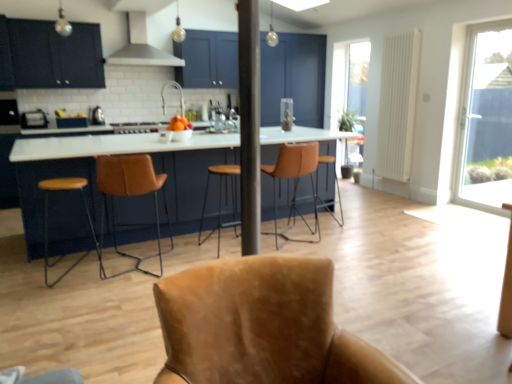
The image size is (512, 384). What do you see at coordinates (249, 124) in the screenshot?
I see `metallic pole at center` at bounding box center [249, 124].

The height and width of the screenshot is (384, 512). Describe the element at coordinates (34, 119) in the screenshot. I see `matte black toaster at left, positioned as the second appliance in back-to-front order` at that location.

The width and height of the screenshot is (512, 384). What are the coordinates of `matte black toaster at left, positioned as the second appliance in back-to-front order` in the screenshot? It's located at coord(34,119).

Looking at this image, in order to face transparent glass door at right, should I rotate leftwards or rightwards?

Rotate your view right by about 29.318°.

What is the approximate width of white glossy table at center?

1.30 meters.

Image resolution: width=512 pixels, height=384 pixels. What do you see at coordinates (327, 185) in the screenshot? I see `brown leather bar stool at center, marked as the second bar stool in a left-to-right arrangement` at bounding box center [327, 185].

Locate an element on the screen. This screenshot has height=384, width=512. satin silver toaster at left, which ranks as the 3th appliance in front-to-back order is located at coordinates (97, 116).

Consider the image. How far apart are brown leather bar stool at center, which appears as the 1th bar stool when viewed from the left, and white glossy table at center?

A distance of 21.81 inches exists between brown leather bar stool at center, which appears as the 1th bar stool when viewed from the left, and white glossy table at center.

Can you confirm if brown leather bar stool at center, which appears as the 1th bar stool when viewed from the left, is thinner than white glossy table at center?

Yes, brown leather bar stool at center, which appears as the 1th bar stool when viewed from the left, is thinner than white glossy table at center.

From a real-world perspective, is brown leather bar stool at center, marked as the 2th bar stool in a right-to-left arrangement, on white glossy table at center?

Incorrect, from a real-world perspective, brown leather bar stool at center, marked as the 2th bar stool in a right-to-left arrangement, is lower than white glossy table at center.

Is brown leather bar stool at center, acting as the 1th bar stool starting from the front, inside or outside of white glossy table at center?

brown leather bar stool at center, acting as the 1th bar stool starting from the front, fits inside white glossy table at center.

Is matte black toaster at left, the 2th appliance in the right-to-left sequence, not inside suede tan armchair at center, marked as the 4th chair in a back-to-front arrangement?

That's correct, matte black toaster at left, the 2th appliance in the right-to-left sequence, is outside of suede tan armchair at center, marked as the 4th chair in a back-to-front arrangement.

Is matte black toaster at left, the 2th appliance in the right-to-left sequence, taller or shorter than suede tan armchair at center, marked as the 4th chair in a back-to-front arrangement?

In the image, matte black toaster at left, the 2th appliance in the right-to-left sequence, appears to be shorter than suede tan armchair at center, marked as the 4th chair in a back-to-front arrangement.

From a real-world perspective, between matte black toaster at left, positioned as the second appliance in back-to-front order, and suede tan armchair at center, marked as the 4th chair in a back-to-front arrangement, who is vertically lower?

suede tan armchair at center, marked as the 4th chair in a back-to-front arrangement, is physically lower.

Does point (6, 84) come farther from viewer compared to point (154, 129)?

No, it is not.

Are matte black cabinets at upper left and white glossy stove at center far apart?

No.

Considering the sizes of objects matte black cabinets at upper left and white glossy stove at center in the image provided, who is shorter, matte black cabinets at upper left or white glossy stove at center?

white glossy stove at center is shorter.

How many degrees apart are the facing directions of matte black cabinets at upper left and white glossy stove at center?

The facing directions of matte black cabinets at upper left and white glossy stove at center are 0.672 degrees apart.

Can you confirm if brown leather stool at left, placed as the second chair when sorted from back to front, is smaller than metallic pole at center?

No.

Considering the positions of point (46, 275) and point (241, 226), is point (46, 275) closer or farther from the camera than point (241, 226)?

Point (46, 275).

Is brown leather stool at left, placed as the second chair when sorted from back to front, positioned with its back to metallic pole at center?

No.

From a real-world perspective, count 4th chairs downward from the metallic pole at center and point to it. Please provide its 2D coordinates.

[(48, 217)]

Is point (98, 247) positioned after point (155, 65)?

No, (98, 247) is in front of (155, 65).

From a real-world perspective, is brown leather stool at left, placed as the second chair when sorted from back to front, beneath satin silver metal at upper center?

Yes, from a real-world perspective, brown leather stool at left, placed as the second chair when sorted from back to front, is under satin silver metal at upper center.

From the image's perspective, is brown leather stool at left, which is counted as the 3th chair, starting from the front, above satin silver metal at upper center?

No, from the image's perspective, brown leather stool at left, which is counted as the 3th chair, starting from the front, is not on top of satin silver metal at upper center.

Does brown leather stool at left, placed as the second chair when sorted from back to front, come behind satin silver metal at upper center?

No, brown leather stool at left, placed as the second chair when sorted from back to front, is in front of satin silver metal at upper center.

From the picture: Is brown leather stool at left, placed as the second chair when sorted from back to front, thinner than transparent glass screen door at center?

Indeed, brown leather stool at left, placed as the second chair when sorted from back to front, has a lesser width compared to transparent glass screen door at center.

Considering the sizes of objects brown leather stool at left, which is counted as the 3th chair, starting from the front, and transparent glass screen door at center in the image provided, who is taller, brown leather stool at left, which is counted as the 3th chair, starting from the front, or transparent glass screen door at center?

transparent glass screen door at center is taller.

Considering the sizes of brown leather bar stool at center, marked as the second bar stool in a left-to-right arrangement, and suede tan armchair at center, the 1th chair positioned from the front, in the image, is brown leather bar stool at center, marked as the second bar stool in a left-to-right arrangement, bigger or smaller than suede tan armchair at center, the 1th chair positioned from the front,?

brown leather bar stool at center, marked as the second bar stool in a left-to-right arrangement, is smaller than suede tan armchair at center, the 1th chair positioned from the front.

Is point (331, 201) closer or farther from the camera than point (256, 364)?

Point (331, 201) is farther from the camera than point (256, 364).

From a real-world perspective, count 2nd bar stools downward from the suede tan armchair at center, the 1th chair positioned from the front, and point to it. Please provide its 2D coordinates.

[(327, 185)]

Looking at this image, between brown leather bar stool at center, the first bar stool viewed from the back, and suede tan armchair at center, marked as the 4th chair in a back-to-front arrangement, which one appears on the right side from the viewer's perspective?

Positioned to the right is brown leather bar stool at center, the first bar stool viewed from the back.

Locate an element on the screen. the 1st bar stool positioned below the white glossy table at center (from a real-world perspective) is located at coordinates (221, 200).

Where is `appliance that is the 2nd one when counting leftward from the suede tan armchair at center, the 1th chair positioned from the front`? This screenshot has height=384, width=512. appliance that is the 2nd one when counting leftward from the suede tan armchair at center, the 1th chair positioned from the front is located at coordinates (34, 119).

Looking at the image, which one is located closer to satin silver toaster at left, which appears as the 3th appliance when viewed from the left, satin silver metal at upper center or brown leather bar stool at center, the first bar stool viewed from the back?

satin silver metal at upper center is positioned closer to the anchor satin silver toaster at left, which appears as the 3th appliance when viewed from the left.

Estimate the real-world distances between objects in this image. Which object is further from brown leather bar stool at center, acting as the 1th bar stool starting from the front, matte black toaster at left, positioned as the second appliance in back-to-front order, or transparent glass door at right?

The object further to brown leather bar stool at center, acting as the 1th bar stool starting from the front, is transparent glass door at right.

From the image, which object appears to be farther from leather at left, placed as the 3th chair when sorted from back to front, white glossy table at center or leather bar stool at center, which is the 4th chair from front to back?

leather bar stool at center, which is the 4th chair from front to back.

Estimate the real-world distances between objects in this image. Which object is further from brown leather stool at left, which is counted as the 3th chair, starting from the front, white glossy stove at center or matte black cabinets at upper left?

matte black cabinets at upper left lies further to brown leather stool at left, which is counted as the 3th chair, starting from the front, than the other object.

Which object lies nearer to the anchor point satin silver toaster at left, which ranks as the 3th appliance in front-to-back order, white glossy table at center or brown leather bar stool at center, arranged as the second bar stool when viewed from the front?

white glossy table at center lies closer to satin silver toaster at left, which ranks as the 3th appliance in front-to-back order, than the other object.

When comparing their distances from transparent glass screen door at center, does matte black cabinets at upper left or metallic silver toaster at left, which appears as the 1th appliance when viewed from the left, seem closer?

Among the two, matte black cabinets at upper left is located nearer to transparent glass screen door at center.

Consider the image. Estimate the real-world distances between objects in this image. Which object is closer to satin silver toaster at left, which appears as the 3th appliance when viewed from the left, matte black cabinets at upper left or shiny orange fruit at center?

Based on the image, matte black cabinets at upper left appears to be nearer to satin silver toaster at left, which appears as the 3th appliance when viewed from the left.

Based on their spatial positions, is white glossy table at center or suede tan armchair at center, marked as the 4th chair in a back-to-front arrangement, closer to satin silver metal at upper center?

Among the two, white glossy table at center is located nearer to satin silver metal at upper center.

This screenshot has height=384, width=512. What are the coordinates of `fruit located between brown leather bar stool at center, the 2th bar stool positioned from the back, and white glossy stove at center in the depth direction` in the screenshot? It's located at (179, 124).

Locate an element on the screen. This screenshot has height=384, width=512. fruit between matte black cabinets at upper left and white glossy table at center from left to right is located at coordinates (179, 124).

You are a GUI agent. You are given a task and a screenshot of the screen. Output one action in this format:
    pyautogui.click(x=<x>, y=<y>)
    Task: Click on the fruit between metallic pole at center and brown leather bar stool at center, arranged as the second bar stool when viewed from the front, along the z-axis
    The image size is (512, 384).
    Given the screenshot: What is the action you would take?
    pyautogui.click(x=179, y=124)

The image size is (512, 384). Identify the location of table located between matte black toaster at left, positioned as the second appliance in back-to-front order, and brown leather bar stool at center, marked as the 2th bar stool in a right-to-left arrangement, in the left-right direction. (115, 154).